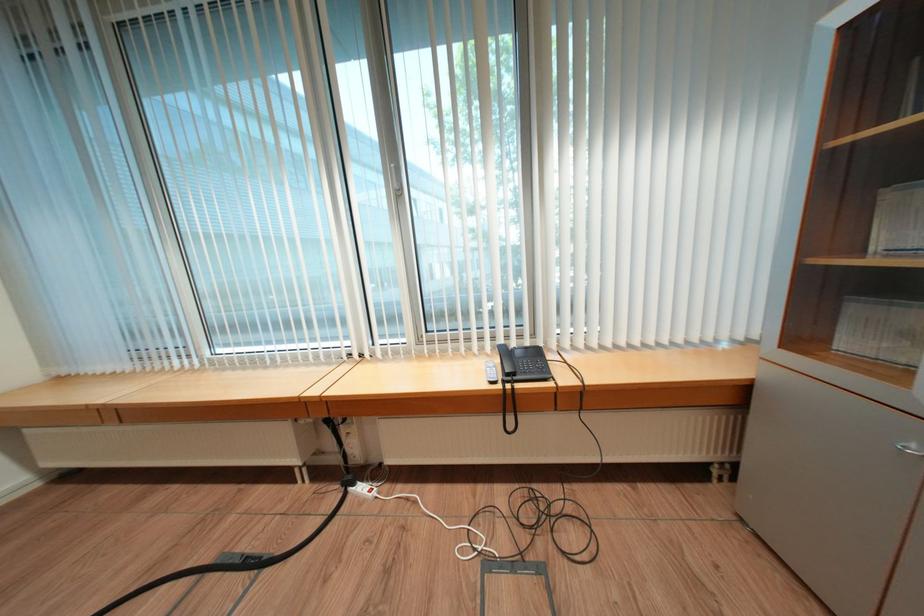
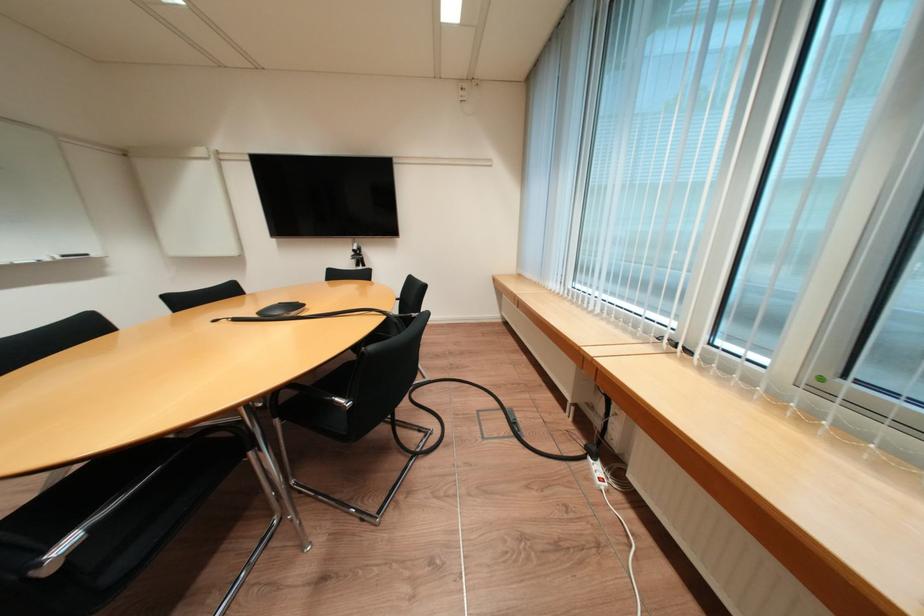
Find the pixel in the second image that matches (297,131) in the first image.

(740, 15)